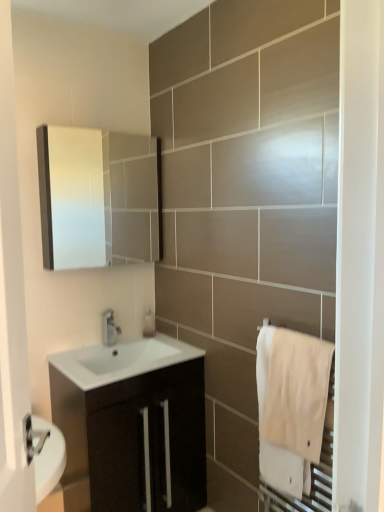
Where is `vacant region in front of satin nickel faucet at center`? This screenshot has width=384, height=512. vacant region in front of satin nickel faucet at center is located at coordinates point(93,353).